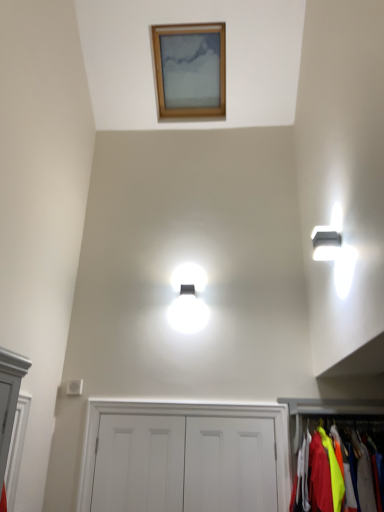
Question: Is wooden picture frame at upper center bigger than white matte door at center, placed as the first door when sorted from left to right?

Choices:
 (A) no
 (B) yes

Answer: (B)

Question: Is wooden picture frame at upper center wider than white matte door at center, which appears as the 2th door when viewed from the right?

Choices:
 (A) yes
 (B) no

Answer: (A)

Question: Considering the relative sizes of wooden picture frame at upper center and white matte door at center, placed as the first door when sorted from left to right, in the image provided, is wooden picture frame at upper center thinner than white matte door at center, placed as the first door when sorted from left to right,?

Choices:
 (A) yes
 (B) no

Answer: (B)

Question: Is wooden picture frame at upper center at the left side of white matte door at center, which appears as the 2th door when viewed from the right?

Choices:
 (A) yes
 (B) no

Answer: (B)

Question: Is white matte door at center, placed as the first door when sorted from left to right, inside wooden picture frame at upper center?

Choices:
 (A) no
 (B) yes

Answer: (A)

Question: Does wooden picture frame at upper center lie in front of white matte door at center, which appears as the 2th door when viewed from the right?

Choices:
 (A) no
 (B) yes

Answer: (A)

Question: Can you confirm if white matte door at center, marked as the second dresser in a right-to-left arrangement, is wider than white matte door at center, which appears as the 2th door when viewed from the right?

Choices:
 (A) no
 (B) yes

Answer: (B)

Question: From a real-world perspective, is white matte door at center, marked as the second dresser in a right-to-left arrangement, over white matte door at center, which appears as the 2th door when viewed from the right?

Choices:
 (A) yes
 (B) no

Answer: (A)

Question: Does white matte door at center, marked as the second dresser in a right-to-left arrangement, have a larger size compared to white matte door at center, placed as the first door when sorted from left to right?

Choices:
 (A) yes
 (B) no

Answer: (A)

Question: Can you confirm if white matte door at center, positioned as the first dresser in left-to-right order, is thinner than white matte door at center, placed as the first door when sorted from left to right?

Choices:
 (A) no
 (B) yes

Answer: (A)

Question: Considering the relative sizes of white matte door at center, marked as the second dresser in a right-to-left arrangement, and white matte door at center, which appears as the 2th door when viewed from the right, in the image provided, is white matte door at center, marked as the second dresser in a right-to-left arrangement, shorter than white matte door at center, which appears as the 2th door when viewed from the right,?

Choices:
 (A) no
 (B) yes

Answer: (A)

Question: Is white matte door at center, placed as the first door when sorted from left to right, at the back of white matte door at center, positioned as the first dresser in left-to-right order?

Choices:
 (A) no
 (B) yes

Answer: (B)

Question: Is white matte door at center, which ranks as the first door in right-to-left order, not close to neon yellow fabric at lower right, the first dresser from the right?

Choices:
 (A) yes
 (B) no

Answer: (B)